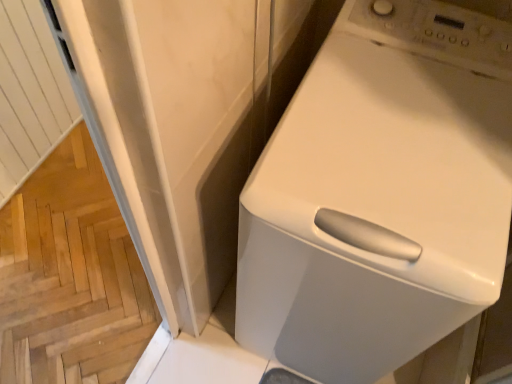
Question: Is wooden parquet floor at lower left taller or shorter than white glossy washing machine at upper right?

Choices:
 (A) short
 (B) tall

Answer: (A)

Question: From a real-world perspective, is wooden parquet floor at lower left above or below white glossy washing machine at upper right?

Choices:
 (A) below
 (B) above

Answer: (A)

Question: In terms of size, does wooden parquet floor at lower left appear bigger or smaller than white glossy washing machine at upper right?

Choices:
 (A) small
 (B) big

Answer: (A)

Question: Is point (352, 52) closer or farther from the camera than point (73, 228)?

Choices:
 (A) closer
 (B) farther

Answer: (A)

Question: Do you think white glossy washing machine at upper right is within wooden parquet floor at lower left, or outside of it?

Choices:
 (A) inside
 (B) outside

Answer: (B)

Question: Is white glossy washing machine at upper right taller or shorter than wooden parquet floor at lower left?

Choices:
 (A) short
 (B) tall

Answer: (B)

Question: Relative to wooden parquet floor at lower left, is white glossy washing machine at upper right in front or behind?

Choices:
 (A) front
 (B) behind

Answer: (A)